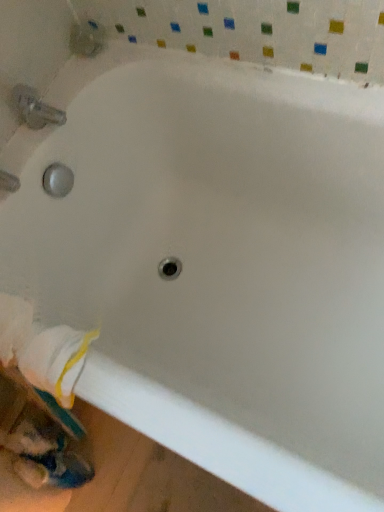
Where is `matte silver faucet at upper left`? The image size is (384, 512). matte silver faucet at upper left is located at coordinates (35, 108).

What is the approximate width of matte silver faucet at upper left?

matte silver faucet at upper left is 5.53 inches in width.

Describe the element at coordinates (35, 108) in the screenshot. I see `matte silver faucet at upper left` at that location.

Measure the distance between matte silver faucet at upper left and camera.

The distance of matte silver faucet at upper left from camera is 36.44 inches.

This screenshot has height=512, width=384. What are the coordinates of `matte silver faucet at upper left` in the screenshot? It's located at (35, 108).